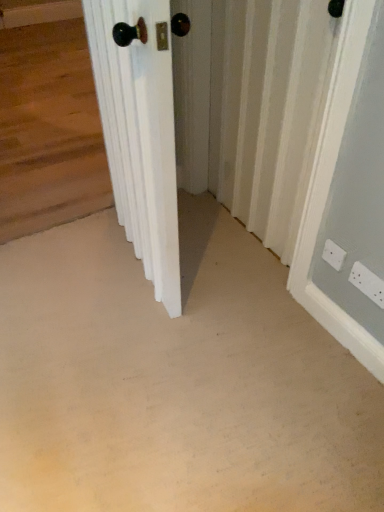
This screenshot has height=512, width=384. What do you see at coordinates (333, 255) in the screenshot? I see `white plastic electric outlet at lower right, the second electric outlet from the right` at bounding box center [333, 255].

The image size is (384, 512). What do you see at coordinates (367, 283) in the screenshot?
I see `white plastic electric outlet at lower right, the 1th electric outlet when ordered from right to left` at bounding box center [367, 283].

Find the location of a particular element. white wooden door at center is located at coordinates (140, 134).

Locate an element on the screen. beige carpet at center is located at coordinates (175, 380).

Is white wooden door at center oriented away from white textured radiator at center?

Yes, white wooden door at center's orientation is away from white textured radiator at center.

Considering the relative sizes of white wooden door at center and white textured radiator at center in the image provided, is white wooden door at center taller than white textured radiator at center?

Indeed, white wooden door at center has a greater height compared to white textured radiator at center.

How many degrees apart are the facing directions of white wooden door at center and white textured radiator at center?

white wooden door at center and white textured radiator at center are facing 8.53 degrees away from each other.

In the scene shown: Considering the positions of objects white wooden door at center and white textured radiator at center in the image provided, who is behind, white wooden door at center or white textured radiator at center?

white textured radiator at center is behind.

Would you say white plastic electric outlet at lower right, which is the first electric outlet in left-to-right order, is inside or outside beige carpet at center?

white plastic electric outlet at lower right, which is the first electric outlet in left-to-right order, is located beyond the bounds of beige carpet at center.

Considering the relative sizes of white plastic electric outlet at lower right, the second electric outlet from the right, and beige carpet at center in the image provided, is white plastic electric outlet at lower right, the second electric outlet from the right, taller than beige carpet at center?

Correct, white plastic electric outlet at lower right, the second electric outlet from the right, is much taller as beige carpet at center.

Identify the location of concrete to the left of white plastic electric outlet at lower right, which is the first electric outlet in left-to-right order. (175, 380).

In the scene shown: Which object is further away from the camera, white plastic electric outlet at lower right, which is the first electric outlet in left-to-right order, or beige carpet at center?

Positioned behind is white plastic electric outlet at lower right, which is the first electric outlet in left-to-right order.

Is white textured radiator at center thinner than white plastic electric outlet at lower right, acting as the 2th electric outlet starting from the left?

Incorrect, the width of white textured radiator at center is not less than that of white plastic electric outlet at lower right, acting as the 2th electric outlet starting from the left.

Can you confirm if white textured radiator at center is bigger than white plastic electric outlet at lower right, the 1th electric outlet when ordered from right to left?

Yes.

In the scene shown: From a real-world perspective, does white plastic electric outlet at lower right, the 1th electric outlet when ordered from right to left, sit lower than beige carpet at center?

No, from a real-world perspective, white plastic electric outlet at lower right, the 1th electric outlet when ordered from right to left, is not beneath beige carpet at center.

Is white plastic electric outlet at lower right, acting as the 2th electric outlet starting from the left, not within beige carpet at center?

Yes, white plastic electric outlet at lower right, acting as the 2th electric outlet starting from the left, is located beyond the bounds of beige carpet at center.

Which of these two, white plastic electric outlet at lower right, acting as the 2th electric outlet starting from the left, or beige carpet at center, is wider?

beige carpet at center is wider.

Is white plastic electric outlet at lower right, acting as the 2th electric outlet starting from the left, far away from beige carpet at center?

That's not correct — white plastic electric outlet at lower right, acting as the 2th electric outlet starting from the left, is a little close to beige carpet at center.

Which is correct: white wooden door at center is inside white plastic electric outlet at lower right, acting as the 2th electric outlet starting from the left, or outside of it?

white wooden door at center is not inside white plastic electric outlet at lower right, acting as the 2th electric outlet starting from the left, it's outside.

Does white wooden door at center have a lesser width compared to white plastic electric outlet at lower right, the 1th electric outlet when ordered from right to left?

Incorrect, the width of white wooden door at center is not less than that of white plastic electric outlet at lower right, the 1th electric outlet when ordered from right to left.

Is white wooden door at center smaller than white plastic electric outlet at lower right, the 1th electric outlet when ordered from right to left?

Actually, white wooden door at center might be larger than white plastic electric outlet at lower right, the 1th electric outlet when ordered from right to left.

Is white wooden door at center next to white plastic electric outlet at lower right, acting as the 2th electric outlet starting from the left?

No, white wooden door at center is not beside white plastic electric outlet at lower right, acting as the 2th electric outlet starting from the left.

In terms of width, does beige carpet at center look wider or thinner when compared to white plastic electric outlet at lower right, the 1th electric outlet when ordered from right to left?

Considering their sizes, beige carpet at center looks broader than white plastic electric outlet at lower right, the 1th electric outlet when ordered from right to left.

Considering the relative positions of beige carpet at center and white plastic electric outlet at lower right, acting as the 2th electric outlet starting from the left, in the image provided, is beige carpet at center to the left or to the right of white plastic electric outlet at lower right, acting as the 2th electric outlet starting from the left,?

Based on their positions, beige carpet at center is located to the left of white plastic electric outlet at lower right, acting as the 2th electric outlet starting from the left.

Is beige carpet at center taller than white plastic electric outlet at lower right, acting as the 2th electric outlet starting from the left?

Incorrect, the height of beige carpet at center is not larger of that of white plastic electric outlet at lower right, acting as the 2th electric outlet starting from the left.

From the image's perspective, who appears lower, beige carpet at center or white plastic electric outlet at lower right, the 1th electric outlet when ordered from right to left?

beige carpet at center appears lower in the image.

Which is closer, (256, 91) or (323, 252)?

Point (256, 91) is farther from the camera than point (323, 252).

Is white textured radiator at center spatially inside white plastic electric outlet at lower right, the second electric outlet from the right, or outside of it?

white textured radiator at center exists outside the volume of white plastic electric outlet at lower right, the second electric outlet from the right.

Could you measure the distance between white textured radiator at center and white plastic electric outlet at lower right, which is the first electric outlet in left-to-right order?

white textured radiator at center is 23.20 inches from white plastic electric outlet at lower right, which is the first electric outlet in left-to-right order.

Locate an element on the screen. The image size is (384, 512). door above the white textured radiator at center (from a real-world perspective) is located at coordinates (140, 134).

The image size is (384, 512). What are the coordinates of `concrete lying in front of the white plastic electric outlet at lower right, which is the first electric outlet in left-to-right order` in the screenshot? It's located at (175, 380).

Based on their spatial positions, is white plastic electric outlet at lower right, acting as the 2th electric outlet starting from the left, or beige carpet at center closer to white textured radiator at center?

beige carpet at center is positioned closer to the anchor white textured radiator at center.

Looking at the image, which one is located closer to white plastic electric outlet at lower right, which is the first electric outlet in left-to-right order, white wooden door at center or white plastic electric outlet at lower right, the 1th electric outlet when ordered from right to left?

white plastic electric outlet at lower right, the 1th electric outlet when ordered from right to left, lies closer to white plastic electric outlet at lower right, which is the first electric outlet in left-to-right order, than the other object.

Considering their positions, is white textured radiator at center positioned further to white wooden door at center than white plastic electric outlet at lower right, acting as the 2th electric outlet starting from the left?

white plastic electric outlet at lower right, acting as the 2th electric outlet starting from the left, is further to white wooden door at center.

Based on their spatial positions, is white plastic electric outlet at lower right, the 1th electric outlet when ordered from right to left, or beige carpet at center further from white wooden door at center?

white plastic electric outlet at lower right, the 1th electric outlet when ordered from right to left, is positioned further to the anchor white wooden door at center.

Based on their spatial positions, is white plastic electric outlet at lower right, the 1th electric outlet when ordered from right to left, or beige carpet at center further from white plastic electric outlet at lower right, which is the first electric outlet in left-to-right order?

Among the two, beige carpet at center is located further to white plastic electric outlet at lower right, which is the first electric outlet in left-to-right order.

Considering their positions, is white wooden door at center positioned further to beige carpet at center than white plastic electric outlet at lower right, the second electric outlet from the right?

white plastic electric outlet at lower right, the second electric outlet from the right, is further to beige carpet at center.

Which object lies nearer to the anchor point beige carpet at center, white plastic electric outlet at lower right, which is the first electric outlet in left-to-right order, or white wooden door at center?

white wooden door at center is closer to beige carpet at center.

Which object lies nearer to the anchor point white textured radiator at center, white plastic electric outlet at lower right, the second electric outlet from the right, or white wooden door at center?

white wooden door at center is closer to white textured radiator at center.

Identify the location of radiator between white wooden door at center and white plastic electric outlet at lower right, the second electric outlet from the right, in the horizontal direction. Image resolution: width=384 pixels, height=512 pixels. (268, 110).

Where is `door between white textured radiator at center and beige carpet at center from top to bottom`? This screenshot has height=512, width=384. door between white textured radiator at center and beige carpet at center from top to bottom is located at coordinates (140, 134).

Where is `door between beige carpet at center and white plastic electric outlet at lower right, the second electric outlet from the right`? The image size is (384, 512). door between beige carpet at center and white plastic electric outlet at lower right, the second electric outlet from the right is located at coordinates (140, 134).

At what (x,y) coordinates should I click in order to perform the action: click on radiator situated between beige carpet at center and white plastic electric outlet at lower right, which is the first electric outlet in left-to-right order, from left to right. Please return your answer as a coordinate pair (x, y). Looking at the image, I should click on (268, 110).